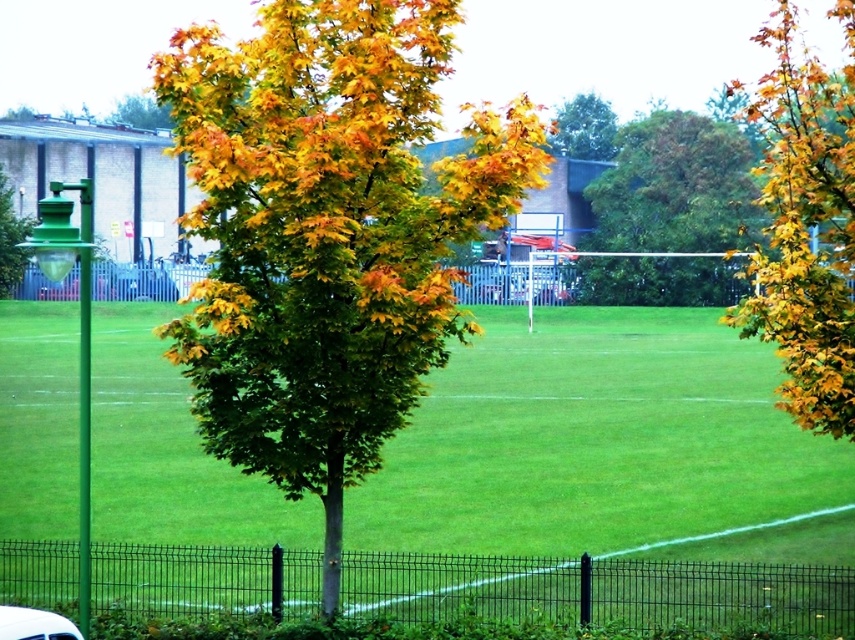
Is white matte car at lower left to the right of golden yellow leaves at center from the viewer's perspective?

Indeed, white matte car at lower left is positioned on the right side of golden yellow leaves at center.

Is point (21, 636) positioned after point (154, 129)?

No, it is not.

This screenshot has height=640, width=855. What are the coordinates of `white matte car at lower left` in the screenshot? It's located at (34, 625).

Who is taller, green grass at center or golden-green foliage at center?

golden-green foliage at center is taller.

Is green grass at center closer to the viewer compared to golden-green foliage at center?

No.

Does point (520, 474) come closer to viewer compared to point (426, 276)?

No, (520, 474) is behind (426, 276).

Where is `green grass at center`? This screenshot has width=855, height=640. green grass at center is located at coordinates (593, 440).

Between point (569, 104) and point (51, 636), which one is positioned behind?

Positioned behind is point (569, 104).

Which of these two, golden yellow leaves at upper center or white matte car at lower left, stands taller?

golden yellow leaves at upper center

Describe the element at coordinates (585, 128) in the screenshot. I see `golden yellow leaves at upper center` at that location.

Image resolution: width=855 pixels, height=640 pixels. Identify the location of golden yellow leaves at upper center. (585, 128).